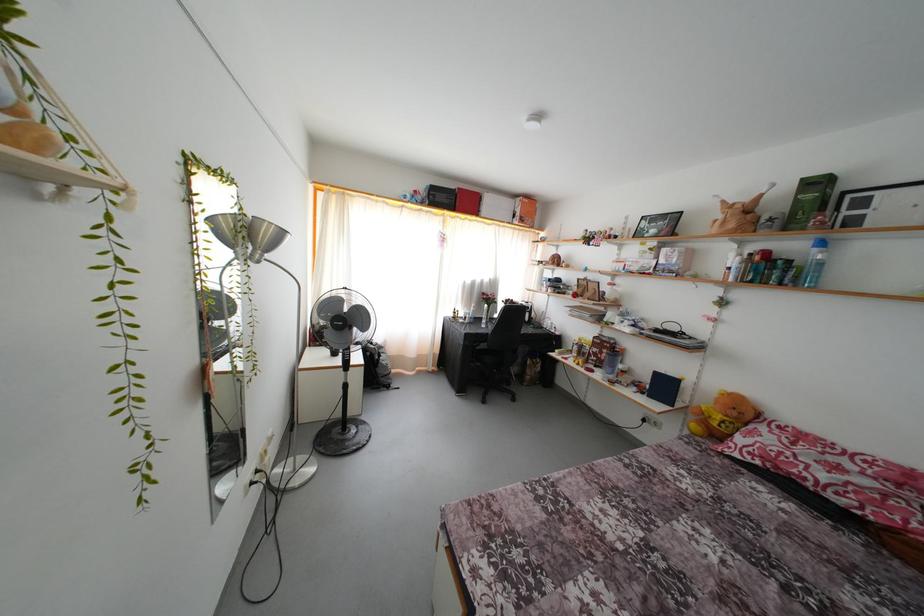
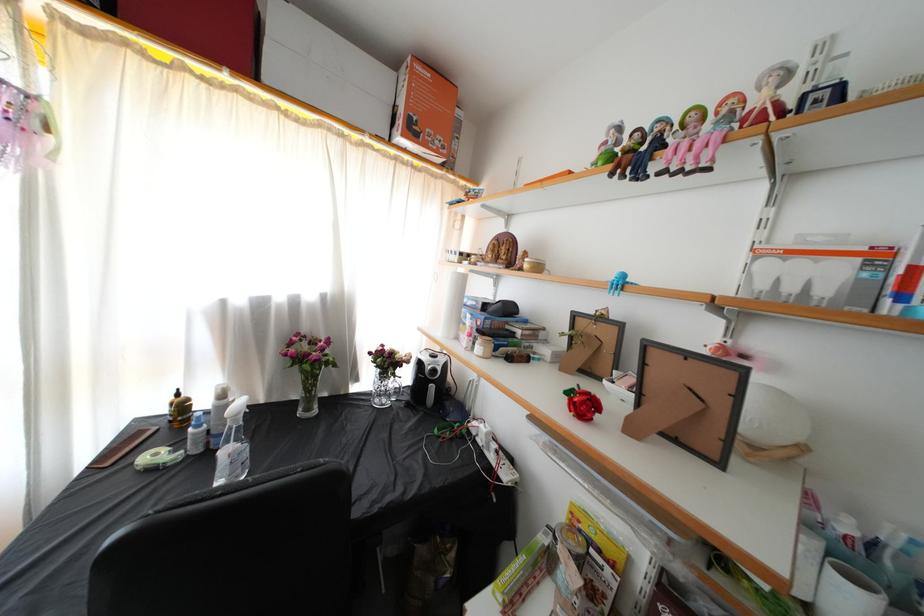
Where in the second image is the point corresponding to point (535, 310) from the first image?

(446, 365)